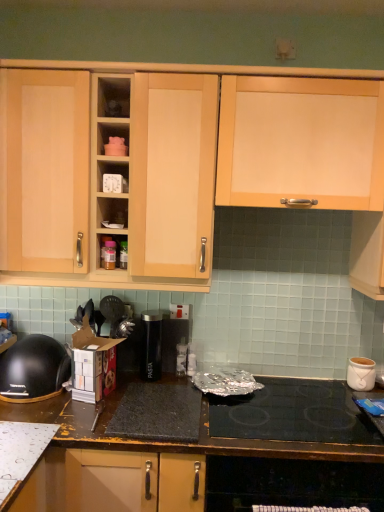
What is the approximate height of matte plastic shelf at center, which is counted as the 2th shelf, starting from the bottom?

matte plastic shelf at center, which is counted as the 2th shelf, starting from the bottom, is 3.52 inches tall.

The height and width of the screenshot is (512, 384). Describe the element at coordinates (212, 456) in the screenshot. I see `dark brown laminate countertop at lower center` at that location.

Identify the location of light wood cabinet at upper right, which ranks as the 2th cabinetry in left-to-right order. (301, 142).

What do you see at coordinates (293, 414) in the screenshot?
I see `black glass cooktop at lower center` at bounding box center [293, 414].

Measure the distance between black matte pasta container at center, which ranks as the second appliance in back-to-front order, and camera.

The distance of black matte pasta container at center, which ranks as the second appliance in back-to-front order, from camera is 6.04 feet.

Locate an element on the screen. light wood cabinet at upper left, the 1th cabinetry viewed from the left is located at coordinates (264, 91).

In the image, is black glass cooktop at lower center positioned in front of or behind black matte pasta container at center, the first appliance viewed from the front?

Clearly, black glass cooktop at lower center is in front of black matte pasta container at center, the first appliance viewed from the front.

From the image's perspective, who appears lower, black glass cooktop at lower center or black matte pasta container at center, the first appliance viewed from the front?

black glass cooktop at lower center appears lower in the image.

Does black glass cooktop at lower center turn towards black matte pasta container at center, the first appliance viewed from the front?

No.

Does point (318, 400) come farther from viewer compared to point (154, 379)?

No, it is not.

Which shelf is the 1st one when counting from the back of the dark brown laminate countertop at lower center? Please provide its 2D coordinates.

[(113, 97)]

How many degrees apart are the facing directions of matte plastic shelf at center, the first shelf viewed from the top, and dark brown laminate countertop at lower center?

matte plastic shelf at center, the first shelf viewed from the top, and dark brown laminate countertop at lower center are facing 0.000352 degrees away from each other.

How far apart are matte plastic shelf at center, which is counted as the 2th shelf, starting from the bottom, and dark brown laminate countertop at lower center?

matte plastic shelf at center, which is counted as the 2th shelf, starting from the bottom, is 1.22 meters from dark brown laminate countertop at lower center.

Is matte plastic shelf at center, which is counted as the 2th shelf, starting from the bottom, further to camera compared to dark brown laminate countertop at lower center?

Yes, the depth of matte plastic shelf at center, which is counted as the 2th shelf, starting from the bottom, is greater than that of dark brown laminate countertop at lower center.

Is white ceramic pot at right to the right of white plastic container at upper center, the 1th shelf from the bottom, from the viewer's perspective?

Yes, white ceramic pot at right is to the right of white plastic container at upper center, the 1th shelf from the bottom.

From the image's perspective, which is below, white ceramic pot at right or white plastic container at upper center, the 1th shelf from the bottom?

white ceramic pot at right appears lower in the image.

Does point (349, 362) appear closer or farther from the camera than point (112, 179)?

Point (349, 362) is farther from the camera than point (112, 179).

From a real-world perspective, between white ceramic pot at right and white plastic container at upper center, which is counted as the second shelf, starting from the top, who is vertically lower?

white ceramic pot at right, from a real-world perspective.

Is black glass cooktop at lower center shorter than light wood cabinet at upper right, the 1th cabinetry in the right-to-left sequence?

Indeed, black glass cooktop at lower center has a lesser height compared to light wood cabinet at upper right, the 1th cabinetry in the right-to-left sequence.

Who is bigger, black glass cooktop at lower center or light wood cabinet at upper right, which ranks as the 2th cabinetry in left-to-right order?

Bigger between the two is light wood cabinet at upper right, which ranks as the 2th cabinetry in left-to-right order.

From a real-world perspective, which object rests below the other?

black glass cooktop at lower center, from a real-world perspective.

Is black glass cooktop at lower center turned away from light wood cabinet at upper right, which ranks as the 2th cabinetry in left-to-right order?

black glass cooktop at lower center is not turned away from light wood cabinet at upper right, which ranks as the 2th cabinetry in left-to-right order.

Considering the positions of objects matte plastic shelf at center, which is counted as the 2th shelf, starting from the bottom, and black plastic bowl at lower left in the image provided, who is more to the left, matte plastic shelf at center, which is counted as the 2th shelf, starting from the bottom, or black plastic bowl at lower left?

Positioned to the left is black plastic bowl at lower left.

Identify the location of home appliance that is behind the matte plastic shelf at center, the first shelf viewed from the top. This screenshot has width=384, height=512. (33, 369).

From the image's perspective, does matte plastic shelf at center, which is counted as the 2th shelf, starting from the bottom, appear higher than black plastic bowl at lower left?

Indeed, from the image's perspective, matte plastic shelf at center, which is counted as the 2th shelf, starting from the bottom, is shown above black plastic bowl at lower left.

Is matte plastic shelf at center, which is counted as the 2th shelf, starting from the bottom, positioned far away from black plastic bowl at lower left?

No, matte plastic shelf at center, which is counted as the 2th shelf, starting from the bottom, is not far from black plastic bowl at lower left.

Is black matte pasta container at center, the 2th appliance positioned from the right, positioned beyond the bounds of white ceramic pot at right?

black matte pasta container at center, the 2th appliance positioned from the right, is positioned outside white ceramic pot at right.

Is black matte pasta container at center, which appears as the first appliance when viewed from the left, placed right next to white ceramic pot at right?

black matte pasta container at center, which appears as the first appliance when viewed from the left, and white ceramic pot at right are clearly separated.

Which object is thinner, black matte pasta container at center, which appears as the first appliance when viewed from the left, or white ceramic pot at right?

With smaller width is black matte pasta container at center, which appears as the first appliance when viewed from the left.

Considering the sizes of black matte pasta container at center, which ranks as the second appliance in back-to-front order, and white ceramic pot at right in the image, is black matte pasta container at center, which ranks as the second appliance in back-to-front order, taller or shorter than white ceramic pot at right?

black matte pasta container at center, which ranks as the second appliance in back-to-front order, is taller than white ceramic pot at right.

Is black glass cooktop at lower center turned away from black plastic bowl at lower left?

No, black glass cooktop at lower center is not facing away from black plastic bowl at lower left.

Measure the distance from black glass cooktop at lower center to black plastic bowl at lower left.

black glass cooktop at lower center and black plastic bowl at lower left are 31.22 inches apart from each other.

Is black glass cooktop at lower center bigger than black plastic bowl at lower left?

Correct, black glass cooktop at lower center is larger in size than black plastic bowl at lower left.

Is black glass cooktop at lower center spatially inside black plastic bowl at lower left, or outside of it?

black glass cooktop at lower center is spatially situated outside black plastic bowl at lower left.

The width and height of the screenshot is (384, 512). I want to click on the 2nd appliance counting from the left side of the black glass cooktop at lower center, so click(151, 345).

The height and width of the screenshot is (512, 384). I want to click on countertop on the right of the matte plastic shelf at center, the first shelf viewed from the top, so click(x=212, y=456).

Looking at the image, which one is located further to black glass cooktop at lower center, white ceramic pot at right or black plastic container at center, the 2th appliance when ordered from left to right?

black plastic container at center, the 2th appliance when ordered from left to right, is further to black glass cooktop at lower center.

Considering their positions, is matte plastic shelf at center, the first shelf viewed from the top, positioned further to light wood cabinet at upper left, the 2th cabinetry in the right-to-left sequence, than dark brown laminate countertop at lower center?

dark brown laminate countertop at lower center.

Based on their spatial positions, is dark brown laminate countertop at lower center or matte plastic shelf at center, the first shelf viewed from the top, closer to white ceramic pot at right?

The object closer to white ceramic pot at right is dark brown laminate countertop at lower center.

In the scene shown: Which object lies nearer to the anchor point dark brown laminate countertop at lower center, matte plastic shelf at center, the first shelf viewed from the top, or black glass cooktop at lower center?

black glass cooktop at lower center lies closer to dark brown laminate countertop at lower center than the other object.

Based on their spatial positions, is white plastic container at upper center, the 1th shelf from the bottom, or matte plastic shelf at center, the first shelf viewed from the top, further from light wood cabinet at upper left, the 1th cabinetry viewed from the left?

white plastic container at upper center, the 1th shelf from the bottom, is positioned further to the anchor light wood cabinet at upper left, the 1th cabinetry viewed from the left.

Which object lies nearer to the anchor point white ceramic pot at right, light wood cabinet at upper right, the 1th cabinetry in the right-to-left sequence, or black glass cooktop at lower center?

Based on the image, black glass cooktop at lower center appears to be nearer to white ceramic pot at right.

Considering their positions, is black glass cooktop at lower center positioned further to white plastic container at upper center, which is counted as the second shelf, starting from the top, than black plastic bowl at lower left?

black glass cooktop at lower center lies further to white plastic container at upper center, which is counted as the second shelf, starting from the top, than the other object.

Which object lies nearer to the anchor point black matte pasta container at center, which ranks as the second appliance in back-to-front order, white plastic container at upper center, which is counted as the second shelf, starting from the top, or white ceramic pot at right?

Among the two, white plastic container at upper center, which is counted as the second shelf, starting from the top, is located nearer to black matte pasta container at center, which ranks as the second appliance in back-to-front order.

Find the location of a particular element. shelf between matte plastic shelf at center, which is counted as the 2th shelf, starting from the bottom, and black matte pasta container at center, which ranks as the second appliance in back-to-front order, in the up-down direction is located at coordinates (113, 177).

Locate an element on the screen. This screenshot has height=512, width=384. appliance between light wood cabinet at upper right, which ranks as the 2th cabinetry in left-to-right order, and black plastic container at center, which ranks as the first appliance in back-to-front order, vertically is located at coordinates (151, 345).

Locate an element on the screen. cabinetry between light wood cabinet at upper right, which ranks as the 2th cabinetry in left-to-right order, and dark brown laminate countertop at lower center in the up-down direction is located at coordinates (264, 91).

The width and height of the screenshot is (384, 512). Identify the location of appliance between light wood cabinet at upper left, the 1th cabinetry viewed from the left, and black plastic container at center, arranged as the second appliance when viewed from the front, in the up-down direction. (151, 345).